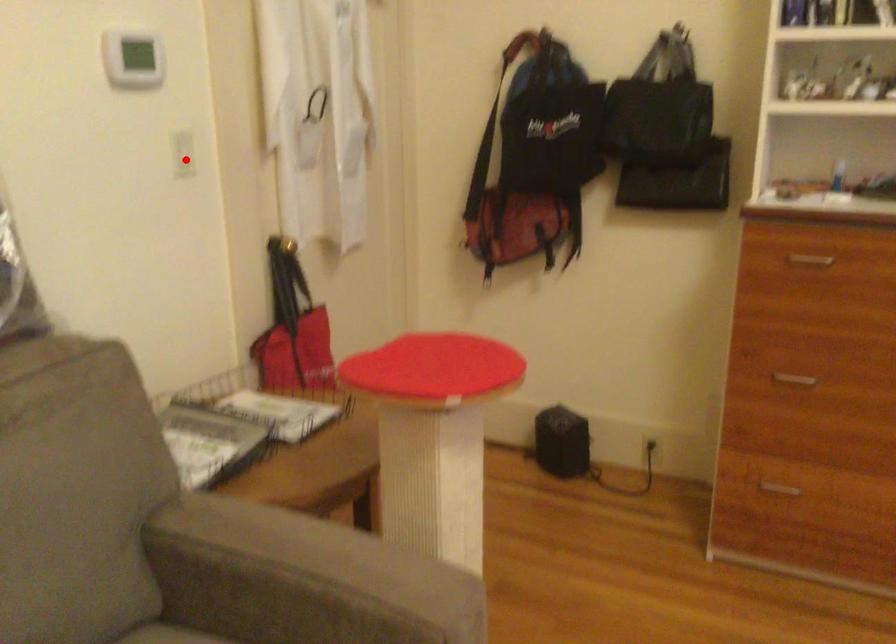
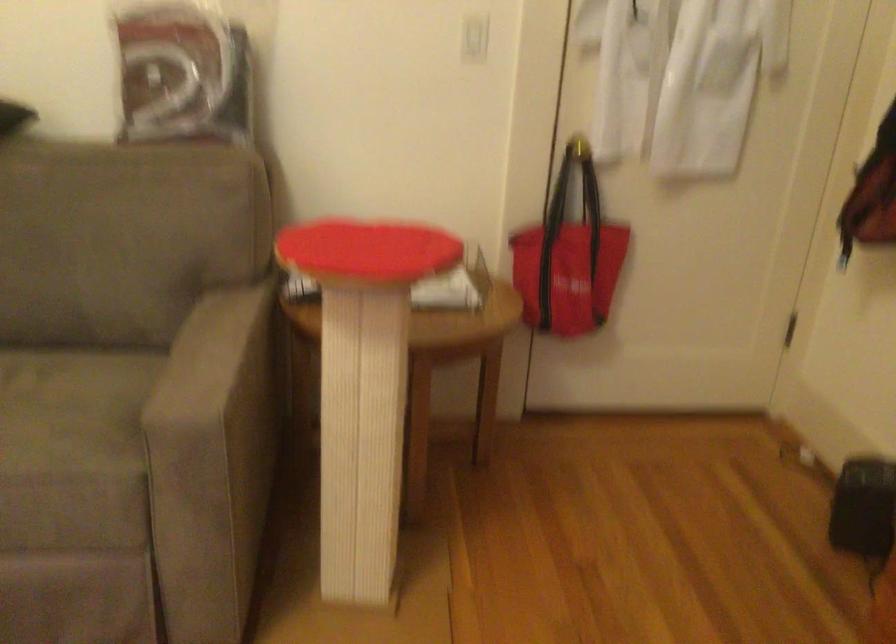
Where in the second image is the point corresponding to the highlighted location from the first image?

(474, 38)